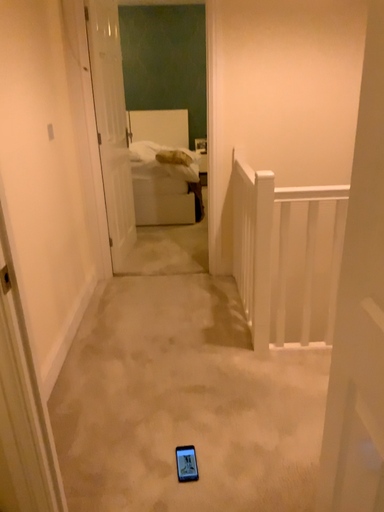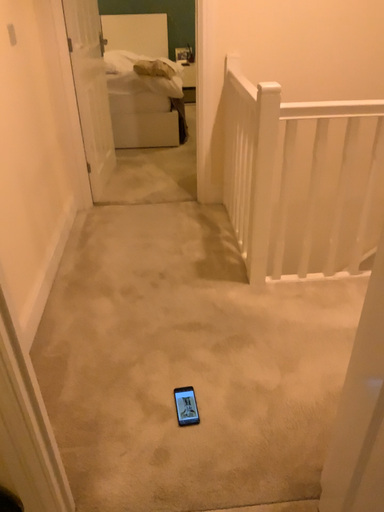
Question: Which way did the camera rotate in the video?

Choices:
 (A) rotated upward
 (B) rotated downward

Answer: (B)